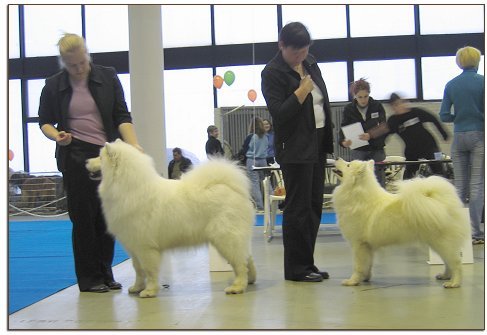
Find the location of a particular element. The height and width of the screenshot is (335, 487). table is located at coordinates (406, 160).